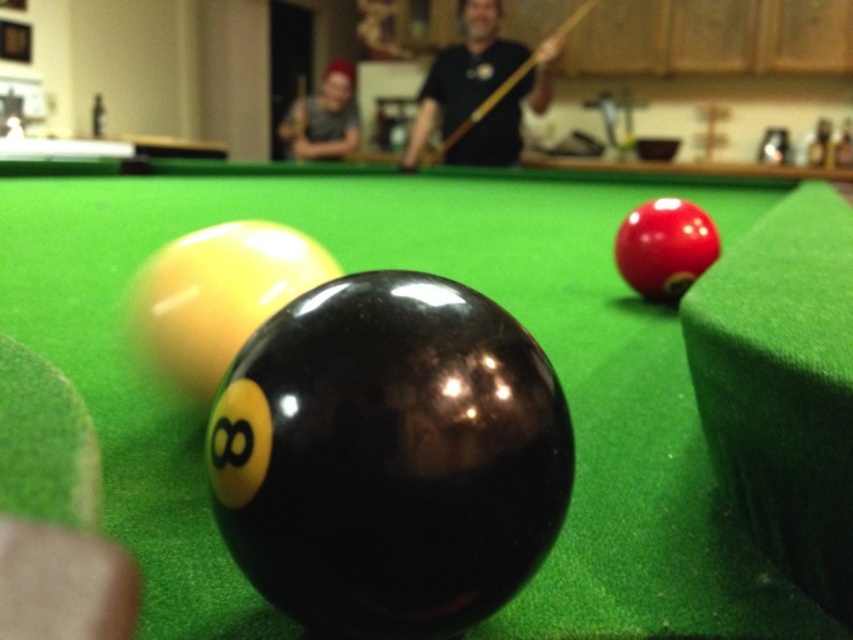
Question: Does matte gray shirt at upper center lie behind wooden at center?

Choices:
 (A) no
 (B) yes

Answer: (B)

Question: Which point appears closest to the camera in this image?

Choices:
 (A) (438, 147)
 (B) (314, 97)

Answer: (A)

Question: Is matte gray shirt at upper center below wooden at center?

Choices:
 (A) yes
 (B) no

Answer: (B)

Question: Which of the following is the closest to the observer?

Choices:
 (A) (341, 113)
 (B) (462, 131)

Answer: (B)

Question: Which point is closer to the camera taking this photo?

Choices:
 (A) (354, 129)
 (B) (479, 109)

Answer: (B)

Question: Can you confirm if matte gray shirt at upper center is smaller than wooden at center?

Choices:
 (A) yes
 (B) no

Answer: (B)